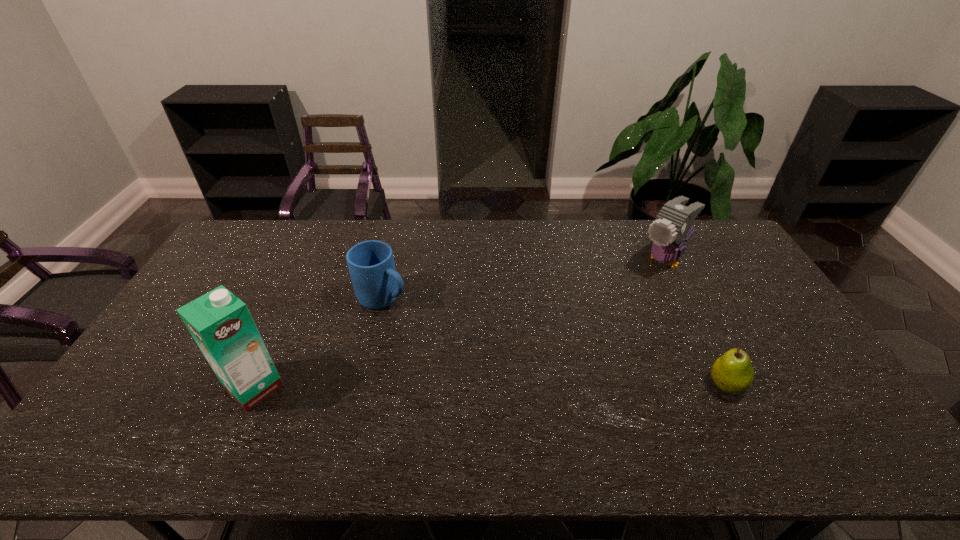
Image resolution: width=960 pixels, height=540 pixels. What are the coordinates of `vacant space on the desktop that is between the carton and the pear and is positioned on the side of the second farthest object with the handle` in the screenshot? It's located at (538, 386).

What are the coordinates of `vacant space on the desktop that is between the leftmost object and the pear and is positioned at the beak of the third shortest object` in the screenshot? It's located at (522, 386).